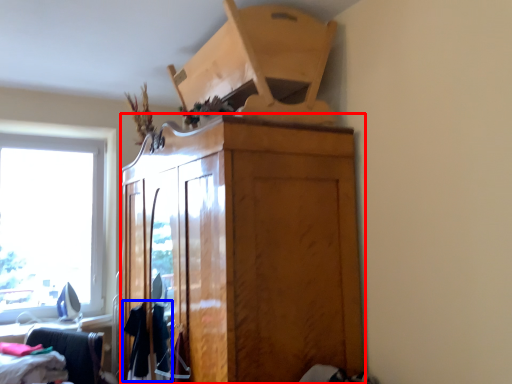
Question: Which of the following is the closest to the observer, cabinetry (highlighted by a red box) or clothing (highlighted by a blue box)?

Choices:
 (A) cabinetry
 (B) clothing

Answer: (A)